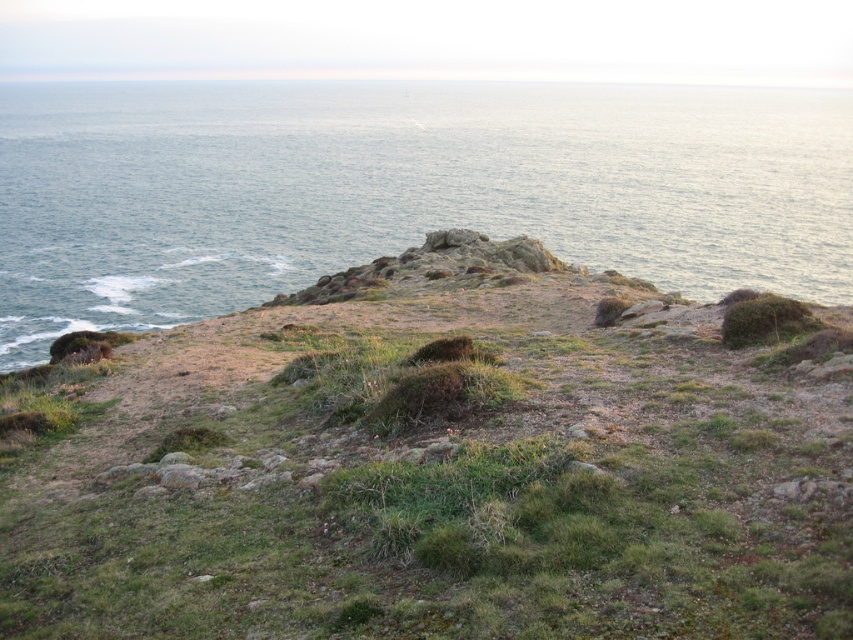
You are standing on the green grassy hillside at center and want to walk towards the blue water at upper center. Which direction should you go?

You should walk towards the blue water at upper center, which is located in the upper part of the scene. Since the green grassy hillside at center is closer to you than the blue water at upper center, you need to move forward towards the upper direction to reach the water.

You are standing on the green grassy hillside at center and want to walk to the blue water at upper center. Which direction should you move to reach the water?

The green grassy hillside at center is positioned on the left side of blue water at upper center, so you should move to the right to reach the blue water at upper center.